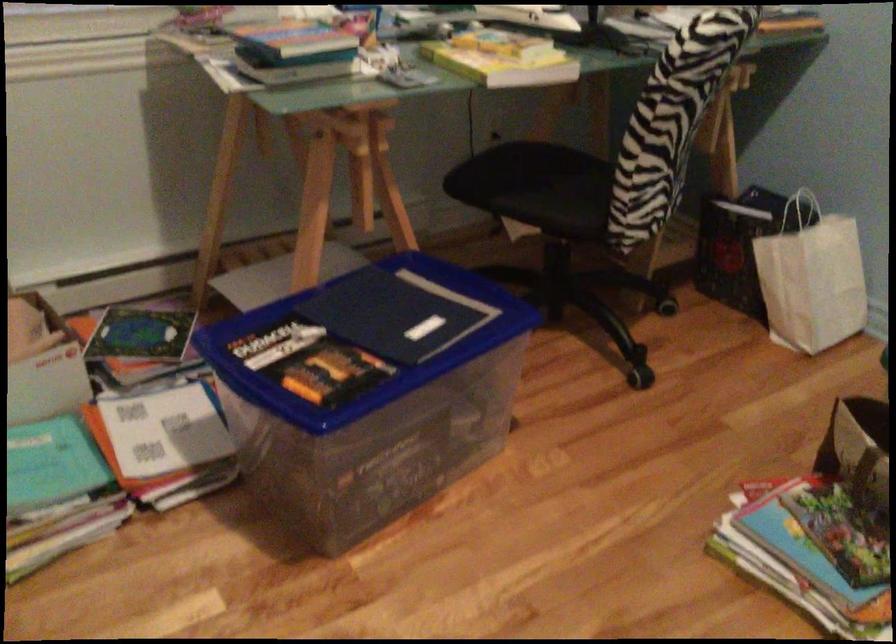
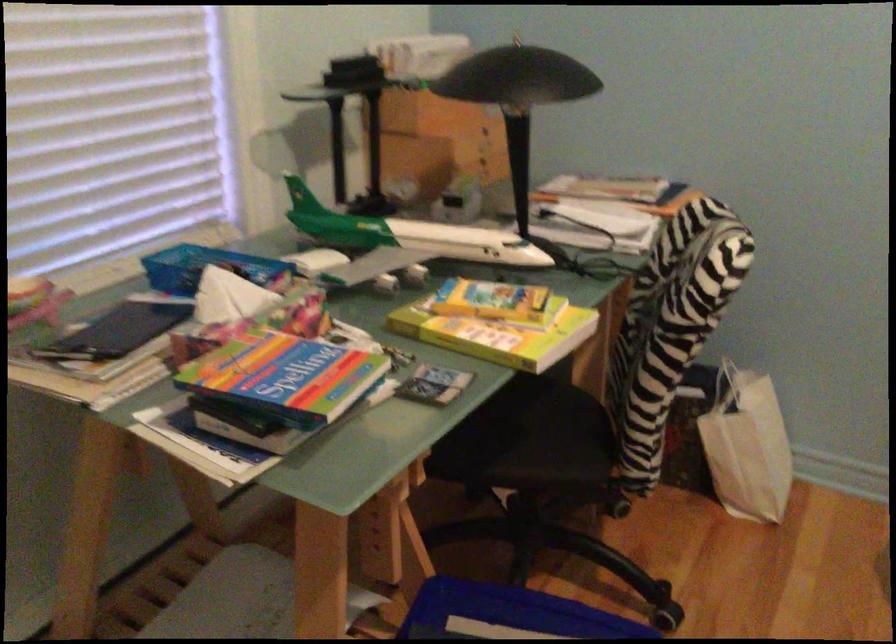
Question: The camera is either moving clockwise (left) or counter-clockwise (right) around the object. The first image is from the beginning of the video and the second image is from the end. Is the camera moving left or right when shooting the video?

Choices:
 (A) Left
 (B) Right

Answer: (A)